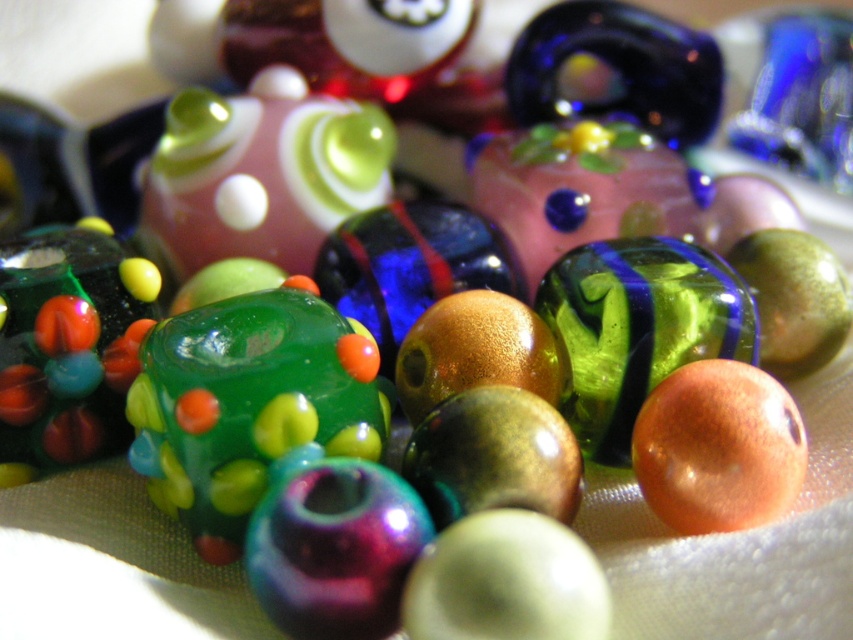
Which is more to the left, green glossy bead at center or matte orange bead at center?

Positioned to the left is green glossy bead at center.

Which of these two, green glossy bead at center or matte orange bead at center, stands shorter?

matte orange bead at center

Is point (241, 483) positioned before point (711, 429)?

That is False.

The height and width of the screenshot is (640, 853). What are the coordinates of `green glossy bead at center` in the screenshot? It's located at (247, 404).

Is green glass bead at center closer to camera compared to matte orange bead at center?

No, it is not.

Which is behind, point (630, 269) or point (775, 413)?

Point (630, 269)

The image size is (853, 640). In order to click on green glass bead at center in this screenshot , I will do `click(637, 328)`.

In order to click on green glossy bead at center-left in this screenshot , I will do `click(68, 346)`.

Can you confirm if green glossy bead at center-left is wider than green glass bead at center?

No.

Between point (76, 461) and point (637, 308), which one is positioned in front?

Point (637, 308) is in front.

The width and height of the screenshot is (853, 640). Identify the location of green glossy bead at center-left. (68, 346).